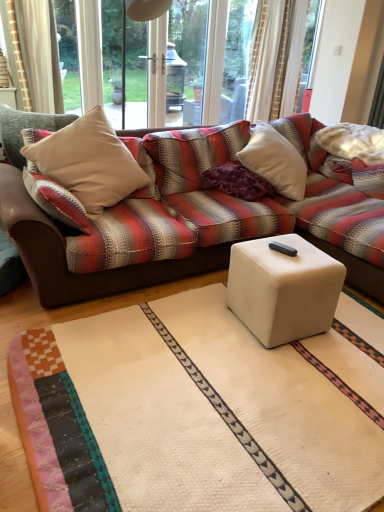
Question: Does white matte cube at center have a greater height compared to beige fabric pillow at left?

Choices:
 (A) no
 (B) yes

Answer: (A)

Question: Is white matte cube at center positioned before beige fabric pillow at left?

Choices:
 (A) yes
 (B) no

Answer: (A)

Question: Is white matte cube at center directly adjacent to beige fabric pillow at left?

Choices:
 (A) yes
 (B) no

Answer: (B)

Question: Is white matte cube at center thinner than beige fabric pillow at left?

Choices:
 (A) no
 (B) yes

Answer: (B)

Question: Is there a large distance between white matte cube at center and beige fabric pillow at left?

Choices:
 (A) yes
 (B) no

Answer: (A)

Question: Can you confirm if white matte cube at center is shorter than beige fabric pillow at left?

Choices:
 (A) yes
 (B) no

Answer: (A)

Question: From a real-world perspective, is purple velvet pillow at center positioned under beige fabric pillow at left based on gravity?

Choices:
 (A) no
 (B) yes

Answer: (B)

Question: From a real-world perspective, does purple velvet pillow at center stand above beige fabric pillow at left?

Choices:
 (A) yes
 (B) no

Answer: (B)

Question: From the image's perspective, does purple velvet pillow at center appear higher than beige fabric pillow at left?

Choices:
 (A) yes
 (B) no

Answer: (A)

Question: Can you confirm if purple velvet pillow at center is taller than beige fabric pillow at left?

Choices:
 (A) no
 (B) yes

Answer: (A)

Question: Does purple velvet pillow at center touch beige fabric pillow at left?

Choices:
 (A) no
 (B) yes

Answer: (A)

Question: Can you confirm if purple velvet pillow at center is smaller than beige fabric pillow at left?

Choices:
 (A) yes
 (B) no

Answer: (A)

Question: From the image's perspective, is beige fabric pillow at left below white matte cube at center?

Choices:
 (A) yes
 (B) no

Answer: (B)